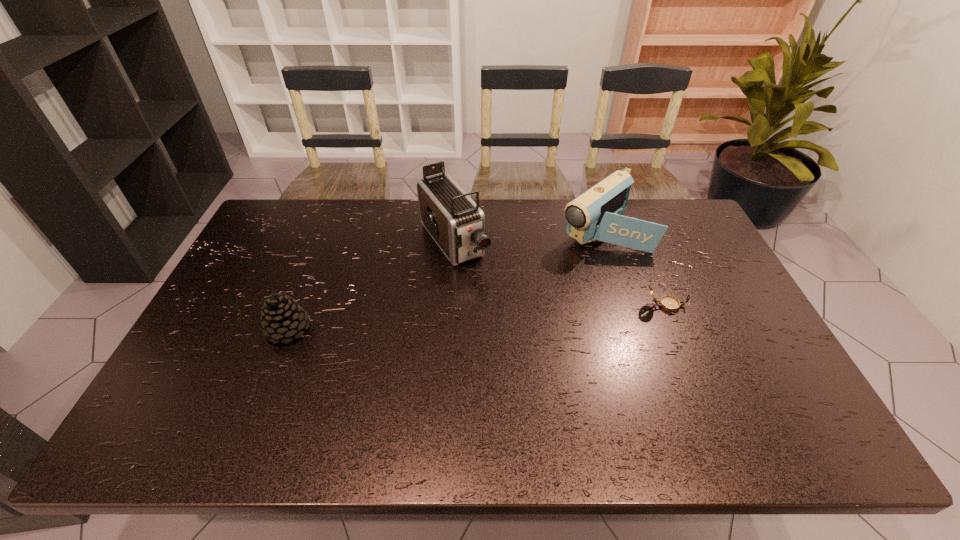
At what (x,y) coordinates should I click in order to perform the action: click on the second shortest object. Please return your answer as a coordinate pair (x, y). Looking at the image, I should click on (282, 318).

The image size is (960, 540). In order to click on the leftmost object in this screenshot , I will do `click(282, 318)`.

This screenshot has height=540, width=960. In order to click on compass in this screenshot , I will do `click(668, 303)`.

Where is `the shortest object`? This screenshot has height=540, width=960. the shortest object is located at coordinates (668, 303).

Where is `the right camcorder`? Image resolution: width=960 pixels, height=540 pixels. the right camcorder is located at coordinates (596, 214).

Locate an element on the screen. The height and width of the screenshot is (540, 960). the third shortest object is located at coordinates (596, 214).

At what (x,y) coordinates should I click in order to perform the action: click on the taller camcorder. Please return your answer as a coordinate pair (x, y). This screenshot has height=540, width=960. Looking at the image, I should click on (456, 223).

Find the location of a particular element. The image size is (960, 540). the left camcorder is located at coordinates (456, 223).

Locate an element on the screen. Image resolution: width=960 pixels, height=540 pixels. vacant space located 0.130m at the narrow end of the leftmost object is located at coordinates (358, 329).

Identify the location of free region located on the face of the third farthest object. (727, 306).